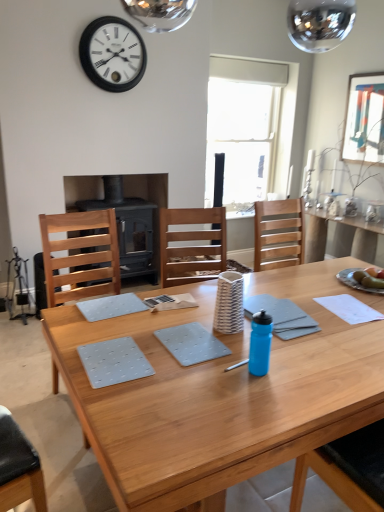
Question: Considering the relative sizes of wooden table at center and white matte wall clock at upper center in the image provided, is wooden table at center thinner than white matte wall clock at upper center?

Choices:
 (A) yes
 (B) no

Answer: (B)

Question: Is wooden table at center placed right next to white matte wall clock at upper center?

Choices:
 (A) yes
 (B) no

Answer: (B)

Question: Is wooden table at center positioned with its back to white matte wall clock at upper center?

Choices:
 (A) yes
 (B) no

Answer: (B)

Question: Does wooden table at center have a lesser height compared to white matte wall clock at upper center?

Choices:
 (A) no
 (B) yes

Answer: (A)

Question: Is wooden table at center surrounding white matte wall clock at upper center?

Choices:
 (A) yes
 (B) no

Answer: (B)

Question: Considering their positions, is gray matte placemat at center, which is counted as the 1th place mat, starting from the bottom, located in front of or behind light wood chair at left?

Choices:
 (A) front
 (B) behind

Answer: (A)

Question: In terms of height, does gray matte placemat at center, which is counted as the 1th place mat, starting from the bottom, look taller or shorter compared to light wood chair at left?

Choices:
 (A) short
 (B) tall

Answer: (A)

Question: Is gray matte placemat at center, which appears as the first place mat when viewed from the front, spatially inside light wood chair at left, or outside of it?

Choices:
 (A) inside
 (B) outside

Answer: (B)

Question: From the image's perspective, relative to light wood chair at left, is gray matte placemat at center, acting as the 2th place mat starting from the top, above or below?

Choices:
 (A) above
 (B) below

Answer: (B)

Question: From a real-world perspective, is light gray fabric placemat at center, which is counted as the 2th place mat, starting from the front, physically located above or below gray matte notebook at center?

Choices:
 (A) below
 (B) above

Answer: (B)

Question: Is light gray fabric placemat at center, positioned as the second place mat in bottom-to-top order, in front of or behind gray matte notebook at center in the image?

Choices:
 (A) front
 (B) behind

Answer: (B)

Question: Considering the positions of point (107, 297) and point (251, 300), is point (107, 297) closer or farther from the camera than point (251, 300)?

Choices:
 (A) farther
 (B) closer

Answer: (A)

Question: Looking at their shapes, would you say light gray fabric placemat at center, which is counted as the 2th place mat, starting from the front, is wider or thinner than gray matte notebook at center?

Choices:
 (A) thin
 (B) wide

Answer: (A)

Question: Is green matte apple at center in front of or behind gray matte notebook at center in the image?

Choices:
 (A) behind
 (B) front

Answer: (A)

Question: From the image's perspective, is green matte apple at center positioned above or below gray matte notebook at center?

Choices:
 (A) below
 (B) above

Answer: (B)